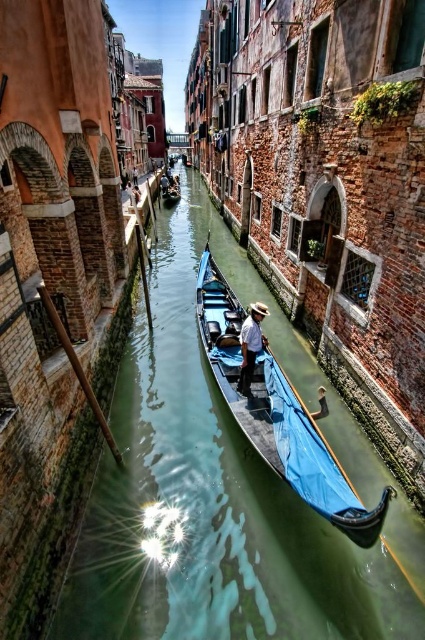
Question: Does blue fabric boat at center have a lesser width compared to light brown straw hat at center?

Choices:
 (A) no
 (B) yes

Answer: (A)

Question: Among these objects, which one is farthest from the camera?

Choices:
 (A) green smooth water at center
 (B) blue fabric boat at center
 (C) light brown straw hat at center

Answer: (C)

Question: Is green smooth water at center further to the viewer compared to blue fabric boat at center?

Choices:
 (A) no
 (B) yes

Answer: (B)

Question: Which of these objects is positioned farthest from the blue fabric boat at center?

Choices:
 (A) light brown straw hat at center
 (B) green smooth water at center

Answer: (B)

Question: Which object is positioned closest to the green smooth water at center?

Choices:
 (A) light brown straw hat at center
 (B) blue fabric boat at center

Answer: (B)

Question: Can you confirm if blue fabric boat at center is positioned to the left of light brown straw hat at center?

Choices:
 (A) yes
 (B) no

Answer: (A)